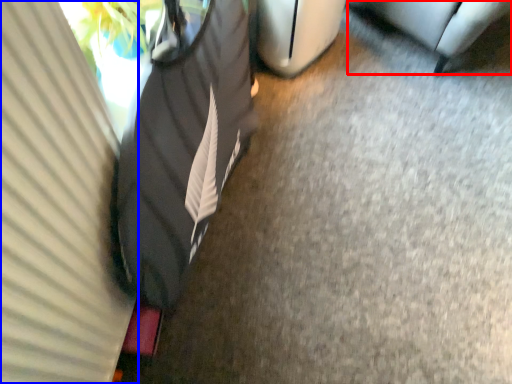
Question: Which object appears closest to the camera in this image, furniture (highlighted by a red box) or curtain (highlighted by a blue box)?

Choices:
 (A) furniture
 (B) curtain

Answer: (B)